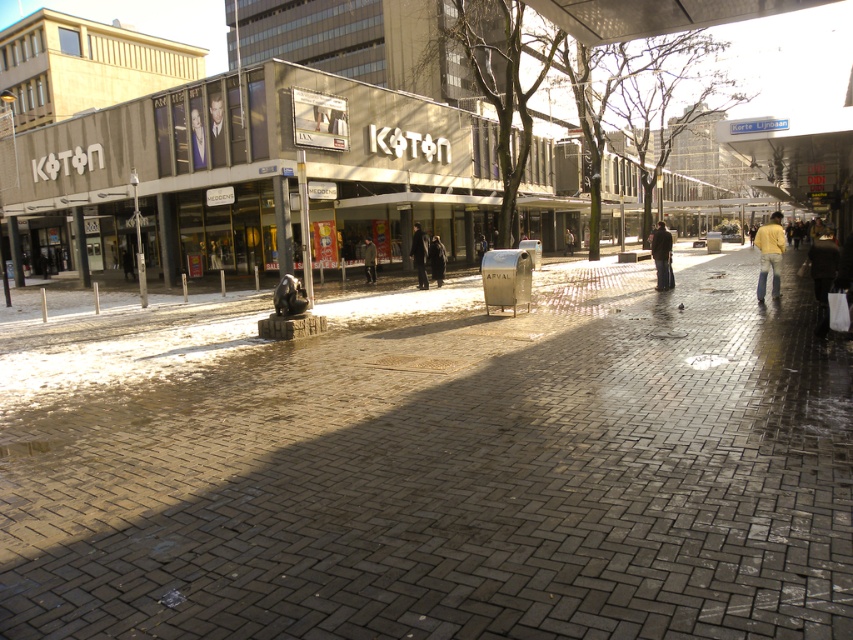
Question: Considering the relative positions of dark brown leather jacket at lower right and yellow cotton jacket at right in the image provided, where is dark brown leather jacket at lower right located with respect to yellow cotton jacket at right?

Choices:
 (A) above
 (B) below

Answer: (A)

Question: Can you confirm if dark blue coat at center is positioned to the right of dark brown leather jacket at center?

Choices:
 (A) no
 (B) yes

Answer: (B)

Question: Which object appears closest to the camera in this image?

Choices:
 (A) dark green jacket at center
 (B) brick paved sidewalk at center
 (C) dark blue coat at center

Answer: (B)

Question: Which point is closer to the camera taking this photo?

Choices:
 (A) (764, 228)
 (B) (370, 241)

Answer: (A)

Question: Considering the real-world distances, which object is closest to the yellow cotton jacket at right?

Choices:
 (A) smooth black suit at upper center
 (B) dark blue coat at center
 (C) smooth skin portrait at center

Answer: (B)

Question: Is brick paved sidewalk at center bigger than dark brown leather jacket at lower right?

Choices:
 (A) yes
 (B) no

Answer: (B)